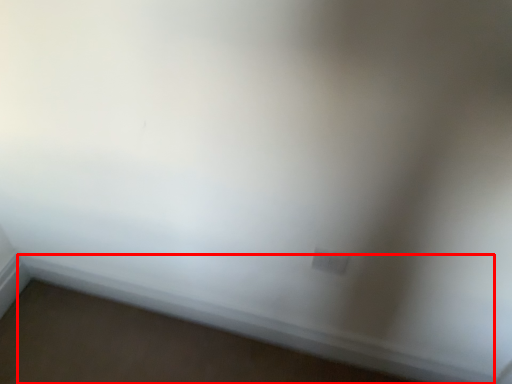
Question: From the image's perspective, what is the correct spatial positioning of window sill (annotated by the red box) in reference to electric outlet?

Choices:
 (A) below
 (B) above

Answer: (A)